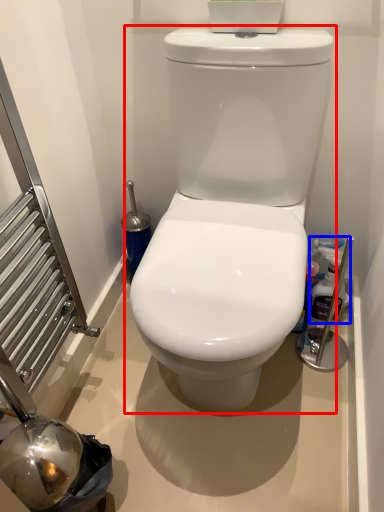
Question: Among these objects, which one is nearest to the camera, toilet (highlighted by a red box) or cleaning product (highlighted by a blue box)?

Choices:
 (A) toilet
 (B) cleaning product

Answer: (A)